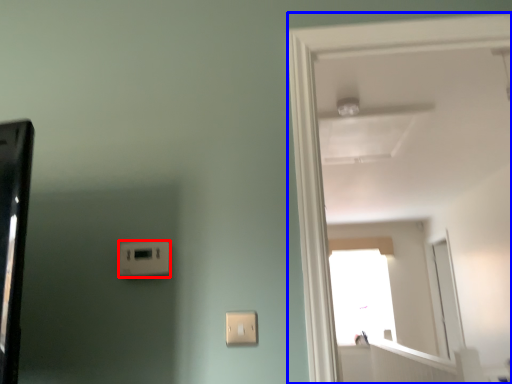
Question: Which of the following is the farthest to the observer, light switch (highlighted by a red box) or door (highlighted by a blue box)?

Choices:
 (A) light switch
 (B) door

Answer: (A)